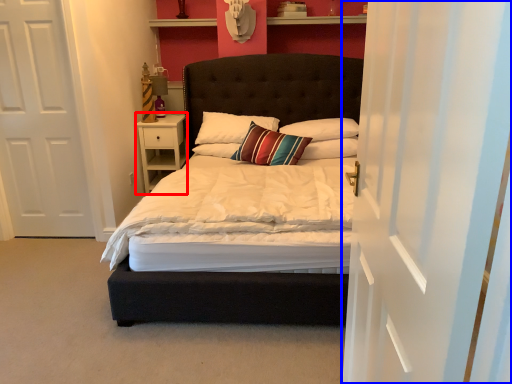
Question: Which object appears farthest to the camera in this image, nightstand (highlighted by a red box) or curtain (highlighted by a blue box)?

Choices:
 (A) nightstand
 (B) curtain

Answer: (A)